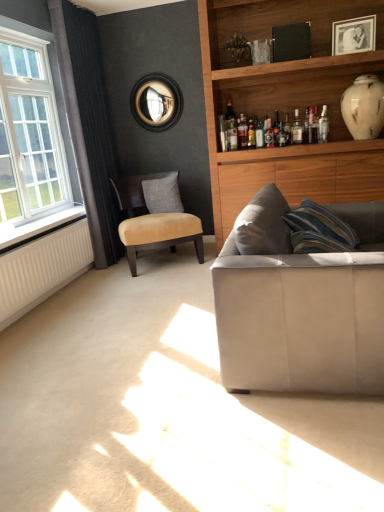
Question: Looking at the image, does suede/leather chair at center-left seem bigger or smaller compared to suede-like beige couch at lower right?

Choices:
 (A) big
 (B) small

Answer: (B)

Question: From the image's perspective, is suede/leather chair at center-left above or below suede-like beige couch at lower right?

Choices:
 (A) below
 (B) above

Answer: (B)

Question: Which is farther from the white plastic window sill at left?

Choices:
 (A) suede/leather chair at center-left
 (B) translucent glass bottle at upper center, the 2th bottle positioned from the left
 (C) dark grey fabric curtain at left
 (D) translucent glass bottle at upper center, arranged as the 2th bottle when viewed from the right
 (E) white glass window at left

Answer: (B)

Question: Which object is the closest to the gray fabric pillow at center?

Choices:
 (A) white glossy vase at upper right
 (B) white glass window at left
 (C) white plastic window sill at left
 (D) suede-like beige couch at lower right
 (E) suede/leather chair at center-left

Answer: (E)